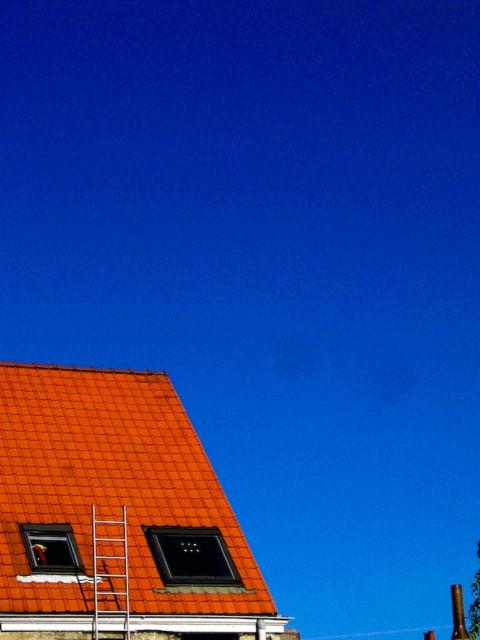
Looking at this image, can you confirm if orange clay tiles at lower left is wider than metallic silver ladder at upper left?

Yes.

Can you confirm if orange clay tiles at lower left is positioned to the left of metallic silver ladder at upper left?

Indeed, orange clay tiles at lower left is positioned on the left side of metallic silver ladder at upper left.

You are a GUI agent. You are given a task and a screenshot of the screen. Output one action in this format:
    pyautogui.click(x=<x>, y=<y>)
    Task: Click on the orange clay tiles at lower left
    The width and height of the screenshot is (480, 640).
    Given the screenshot: What is the action you would take?
    pyautogui.click(x=115, y=493)